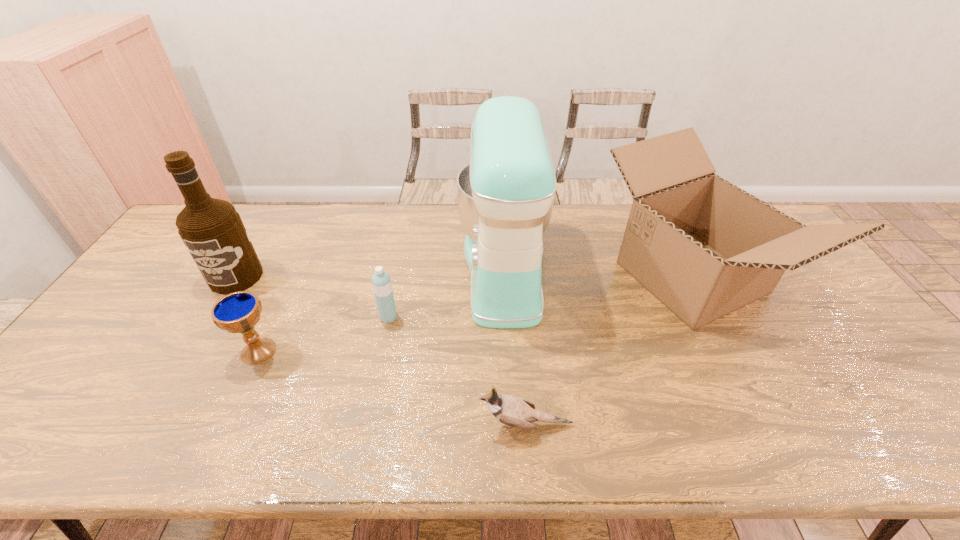
Identify the location of vacant space in between the leftmost object and the third object from left to right. This screenshot has width=960, height=540. (312, 297).

What are the coordinates of `vacant area that lies between the mixer and the nearest object` in the screenshot? It's located at (515, 348).

What are the coordinates of `empty space between the fourth object from right to left and the mixer` in the screenshot? It's located at (446, 294).

Image resolution: width=960 pixels, height=540 pixels. Find the location of `object that stands as the third closest to the fourth object from right to left`. object that stands as the third closest to the fourth object from right to left is located at coordinates (514, 411).

Find the location of `object identified as the third closest to the fifth shortest object`. object identified as the third closest to the fifth shortest object is located at coordinates (506, 193).

I want to click on blank space that satisfies the following two spatial constraints: 1. on the label of the leftmost object; 2. on the right side of the water bottle, so click(x=212, y=317).

Identify the location of free location that satisfies the following two spatial constraints: 1. at the base of the mixer; 2. on the label of the second tallest object. This screenshot has height=540, width=960. (505, 276).

Locate an element on the screen. Image resolution: width=960 pixels, height=540 pixels. vacant space that satisfies the following two spatial constraints: 1. on the front side of the rightmost object; 2. at the face of the nearest object is located at coordinates (767, 424).

Locate an element on the screen. The height and width of the screenshot is (540, 960). vacant space that satisfies the following two spatial constraints: 1. at the base of the mixer; 2. on the label of the second tallest object is located at coordinates (505, 276).